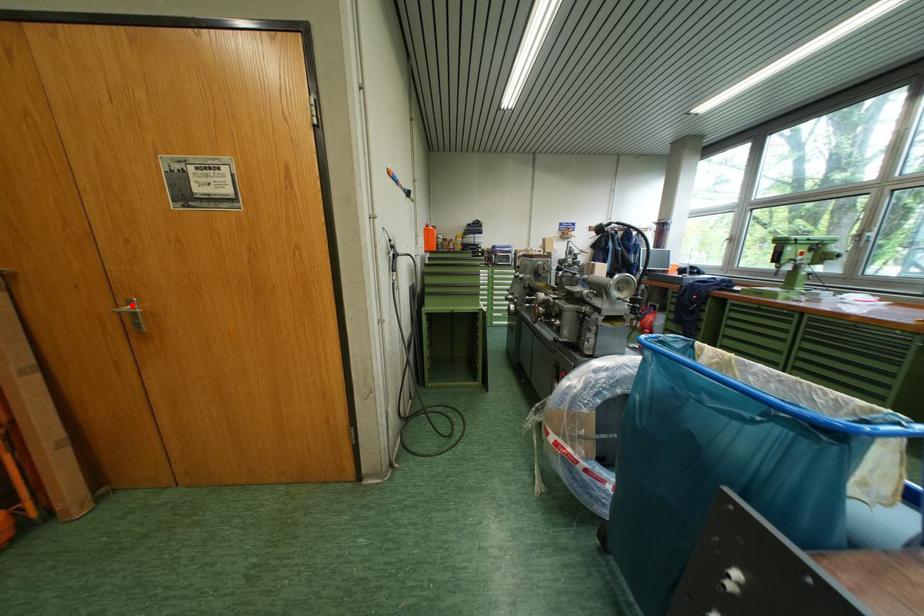
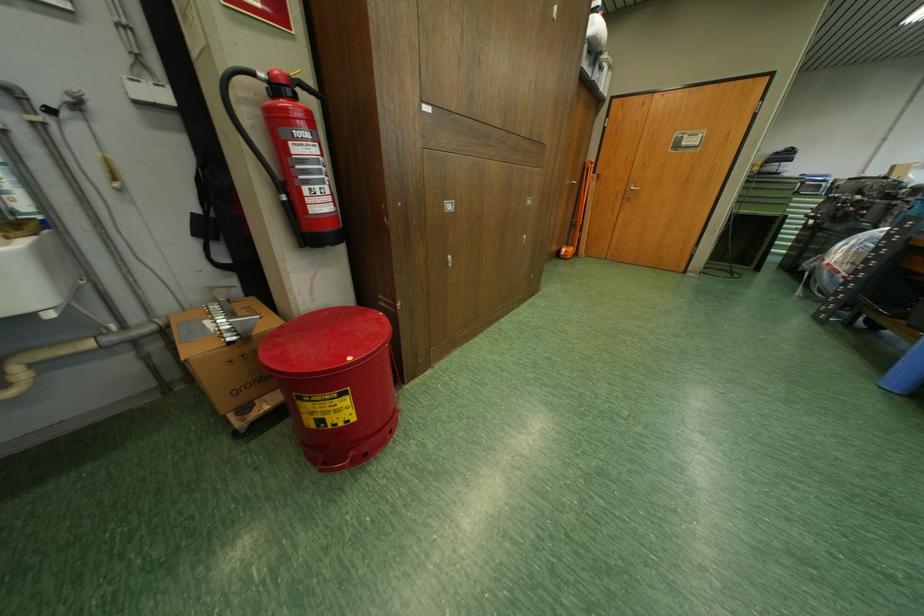
Question: I am providing you with two images of the same scene from different viewpoints. In image1, a red point is highlighted. Considering the same 3D point in image2, which of the following is correct?

Choices:
 (A) It is closer
 (B) It is farther

Answer: (A)